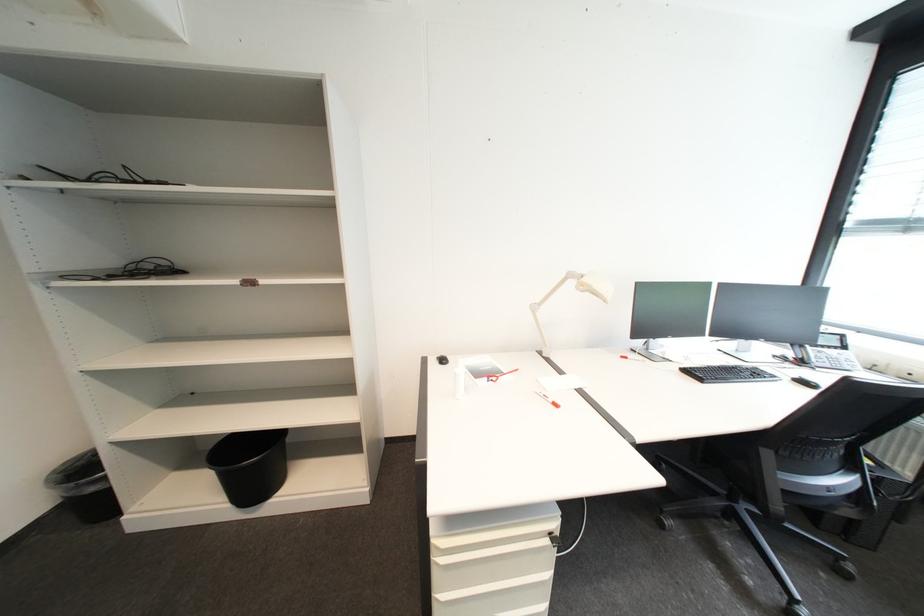
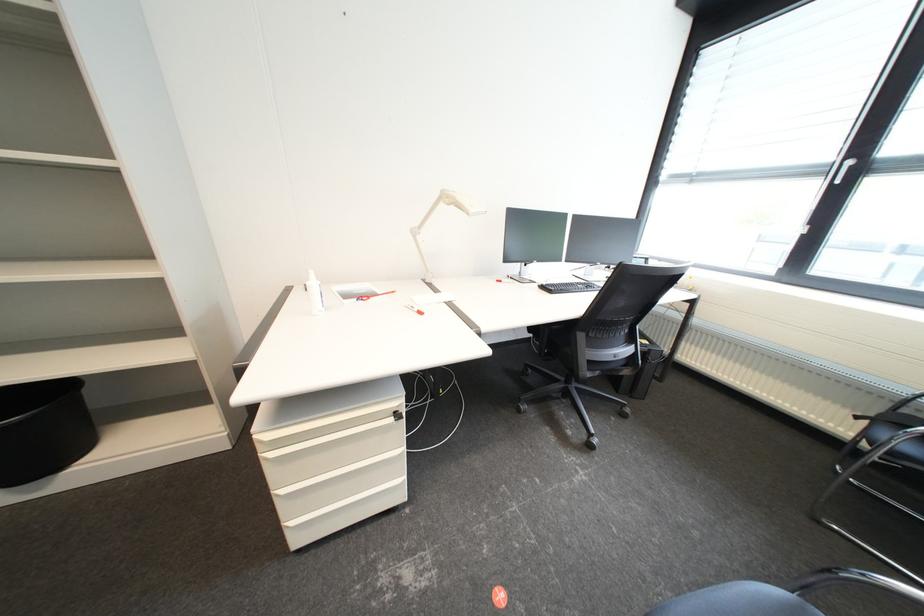
Question: The camera is either moving clockwise (left) or counter-clockwise (right) around the object. The first image is from the beginning of the video and the second image is from the end. Is the camera moving left or right when shooting the video?

Choices:
 (A) Left
 (B) Right

Answer: (A)